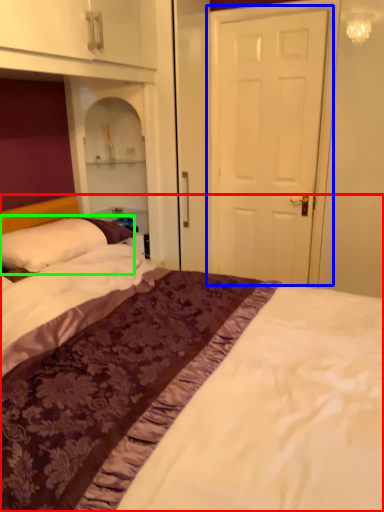
Question: Estimate the real-world distances between objects in this image. Which object is closer to bed (highlighted by a red box), door (highlighted by a blue box) or pillow (highlighted by a green box)?

Choices:
 (A) door
 (B) pillow

Answer: (B)